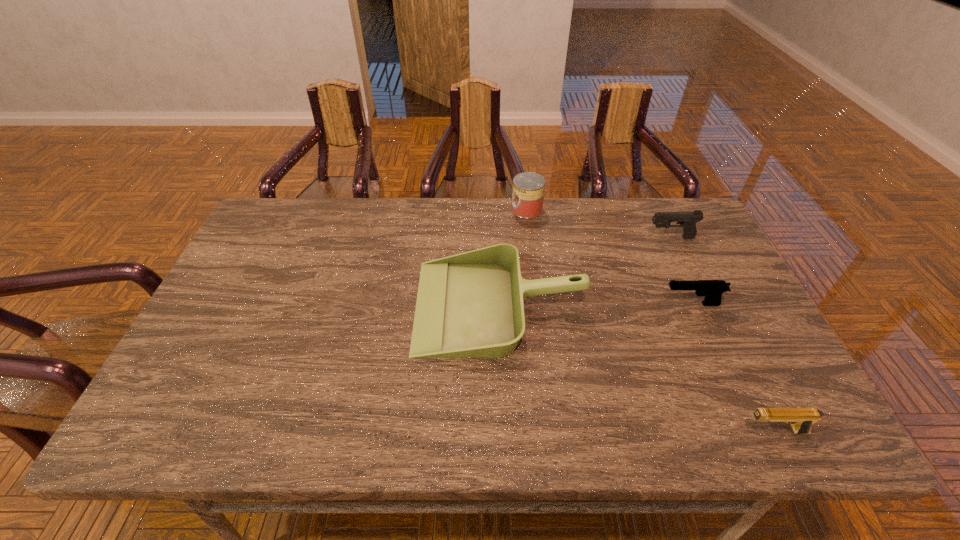
At what (x,y) coordinates should I click in order to perform the action: click on object that is at the near edge. Please return your answer as a coordinate pair (x, y). The width and height of the screenshot is (960, 540). Looking at the image, I should click on (801, 419).

At what (x,y) coordinates should I click in order to perform the action: click on object at the far right corner. Please return your answer as a coordinate pair (x, y). Looking at the image, I should click on [x=687, y=220].

Identify the location of object that is positioned at the near right corner. (801, 419).

Identify the location of vacant point at the far edge. This screenshot has height=540, width=960. tap(374, 240).

At what (x,y) coordinates should I click in order to perform the action: click on vacant space at the near edge. Please return your answer as a coordinate pair (x, y). Looking at the image, I should click on (250, 442).

Locate an element on the screen. vacant space at the left edge of the desktop is located at coordinates (197, 383).

Find the location of a particular element. vacant space at the right edge of the desktop is located at coordinates (753, 353).

Identify the location of free space at the far left corner of the desktop. (268, 223).

In the image, there is a desktop. Identify the location of vacant space at the near left corner. (204, 435).

What are the coordinates of `free space that is in between the nearest object and the farthest pistol` in the screenshot? It's located at (722, 335).